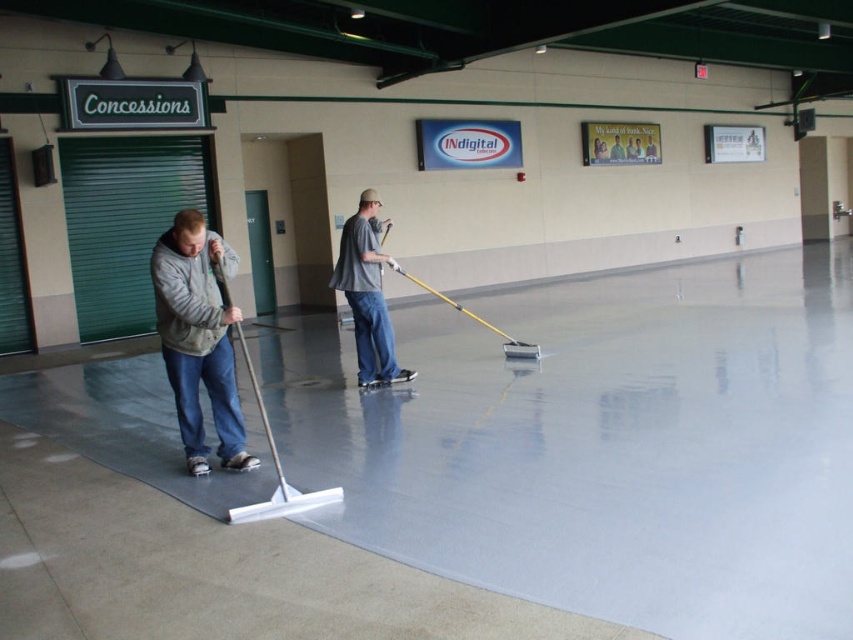
You are standing in the gymnasium and see two points marked on the floor. The first point is labeled as point (408, 388) and the second is point (376, 326). Which point is closer to you?

Point (408, 388) is closer to the viewer than point (376, 326).

You are standing at the entrance of the gymnasium and see two workers cleaning the floor with squeegees. The gray fleece jacket at left and the gray matte shirt at center are part of their outfits. If you walk towards the workers, which worker will you encounter first?

The gray fleece jacket at left is in front of the gray matte shirt at center, so you will encounter the worker in the gray fleece jacket at left first.